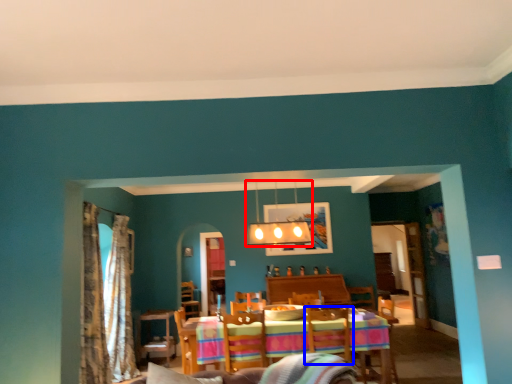
Question: Which object appears closest to the camera in this image, lamp (highlighted by a red box) or swivel chair (highlighted by a blue box)?

Choices:
 (A) lamp
 (B) swivel chair

Answer: (B)